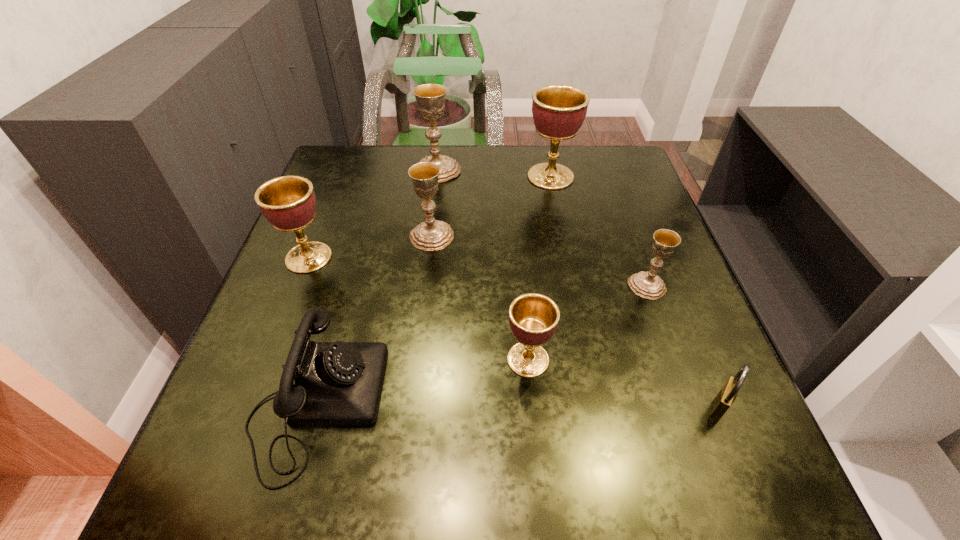
Locate which object ranks fourth in proximity to the telephone. Please provide its 2D coordinates. Your answer should be formatted as a tuple, i.e. [(x, y)], where the tuple contains the x and y coordinates of a point satisfying the conditions above.

[(648, 284)]

Locate an element on the screen. object that is the seventh closest to the smallest gold chalice is located at coordinates (288, 202).

Select which chalice appears as the fourth closest to the biggest golden chalice. Please provide its 2D coordinates. Your answer should be formatted as a tuple, i.e. [(x, y)], where the tuple contains the x and y coordinates of a point satisfying the conditions above.

[(533, 318)]

Locate an element on the screen. chalice that is the fourth closest to the nearest gold chalice is located at coordinates (430, 98).

Identify which gold chalice is the closest to the second smallest gold chalice. Please provide its 2D coordinates. Your answer should be formatted as a tuple, i.e. [(x, y)], where the tuple contains the x and y coordinates of a point satisfying the conditions above.

[(430, 98)]

Choose which gold chalice is the nearest neighbor to the leftmost golden chalice. Please provide its 2D coordinates. Your answer should be formatted as a tuple, i.e. [(x, y)], where the tuple contains the x and y coordinates of a point satisfying the conditions above.

[(432, 234)]

This screenshot has width=960, height=540. In order to click on the second closest golden chalice to the biggest golden chalice in this screenshot , I will do [288, 202].

Select which golden chalice is the second closest to the farthest golden chalice. Please provide its 2D coordinates. Your answer should be formatted as a tuple, i.e. [(x, y)], where the tuple contains the x and y coordinates of a point satisfying the conditions above.

[(288, 202)]

What are the coordinates of `vacant space that satisfies the following two spatial constraints: 1. on the front side of the smallest golden chalice; 2. on the left side of the farthest gold chalice` in the screenshot? It's located at (415, 360).

I want to click on blank area in the image that satisfies the following two spatial constraints: 1. on the front side of the biggest golden chalice; 2. on the left side of the rightmost chalice, so click(x=572, y=286).